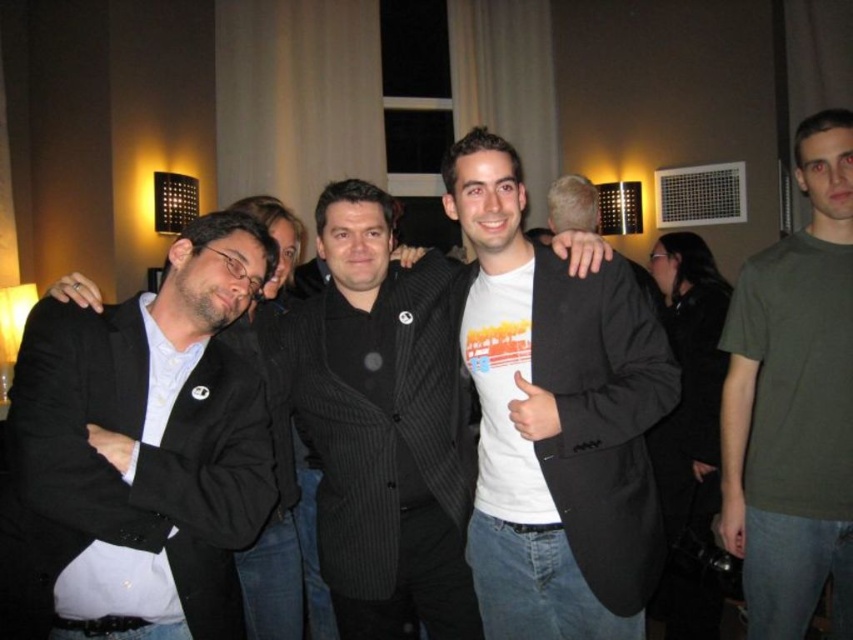
Can you confirm if black pinstripe suit at center is shorter than green matte t-shirt at right?

Yes, black pinstripe suit at center is shorter than green matte t-shirt at right.

The image size is (853, 640). Describe the element at coordinates (380, 428) in the screenshot. I see `black pinstripe suit at center` at that location.

Is point (311, 385) closer to viewer compared to point (805, 428)?

Yes, point (311, 385) is in front of point (805, 428).

Locate an element on the screen. black pinstripe suit at center is located at coordinates (380, 428).

Is matte black blazer at left behind black pinstripe suit at center?

No, it is not.

Which is behind, point (213, 216) or point (564, 243)?

Point (564, 243)

Is point (248, 499) positioned behind point (383, 192)?

That is False.

This screenshot has width=853, height=640. In order to click on matte black blazer at left in this screenshot , I will do `click(144, 438)`.

Is matte black blazer at left wider than green matte t-shirt at right?

Yes.

Find the location of a particular element. The width and height of the screenshot is (853, 640). matte black blazer at left is located at coordinates (144, 438).